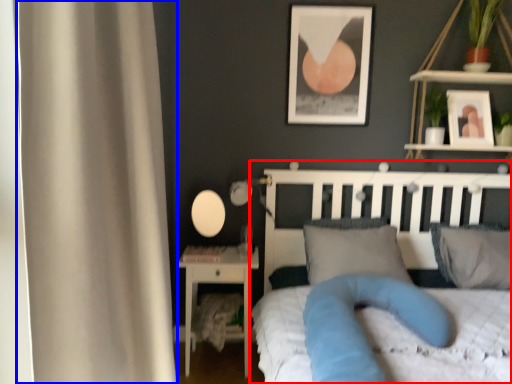
Question: Which object is closer to the camera taking this photo, bed (highlighted by a red box) or curtain (highlighted by a blue box)?

Choices:
 (A) bed
 (B) curtain

Answer: (A)